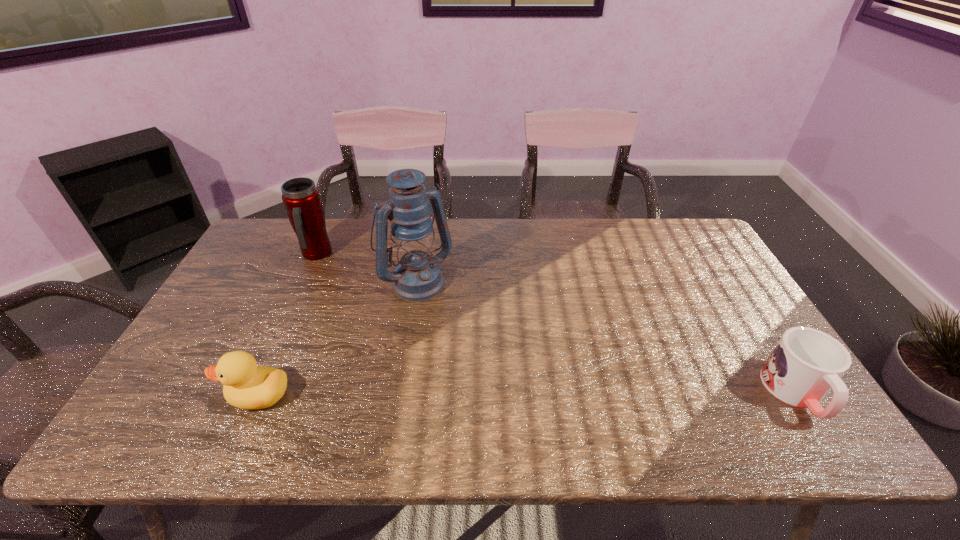
You are a GUI agent. You are given a task and a screenshot of the screen. Output one action in this format:
    pyautogui.click(x=<x>, y=<y>)
    Task: Click on the free location located 0.310m on the front-facing side of the tallest object
    This screenshot has width=960, height=540.
    Given the screenshot: What is the action you would take?
    pyautogui.click(x=494, y=369)

Where is `free space located on the side with the handle of the thermos bottle`? This screenshot has height=540, width=960. free space located on the side with the handle of the thermos bottle is located at coordinates (365, 301).

Locate an element on the screen. free space located on the side with the handle of the thermos bottle is located at coordinates (372, 306).

Find the location of a particular element. The image size is (960, 540). vacant space situated 0.160m on the side with the handle of the thermos bottle is located at coordinates (350, 288).

The height and width of the screenshot is (540, 960). Identify the location of lantern at the far edge. (417, 277).

The width and height of the screenshot is (960, 540). Find the location of `thermos bottle at the far edge`. thermos bottle at the far edge is located at coordinates (301, 198).

The height and width of the screenshot is (540, 960). In order to click on duck present at the near edge in this screenshot , I will do `click(247, 386)`.

Find the location of `mug at the near edge`. mug at the near edge is located at coordinates (806, 364).

Locate an element on the screen. Image resolution: width=960 pixels, height=540 pixels. object that is positioned at the right edge is located at coordinates (806, 364).

The width and height of the screenshot is (960, 540). Find the location of `object at the near right corner`. object at the near right corner is located at coordinates [806, 364].